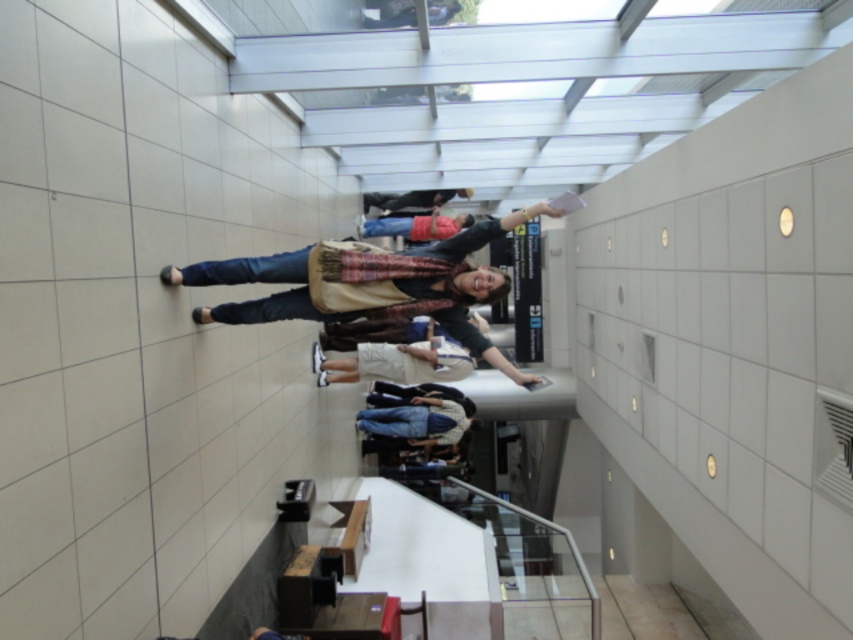
Does denim jeans at center have a greater width compared to matte black backpack at center?

Yes.

Who is more forward, (383, 221) or (405, 195)?

Point (383, 221) is more forward.

Is point (363, 220) positioned in front of point (375, 204)?

No, it is behind (375, 204).

You are a GUI agent. You are given a task and a screenshot of the screen. Output one action in this format:
    pyautogui.click(x=<x>, y=<y>)
    Task: Click on the denim jeans at center
    The height and width of the screenshot is (640, 853).
    Given the screenshot: What is the action you would take?
    pyautogui.click(x=415, y=227)